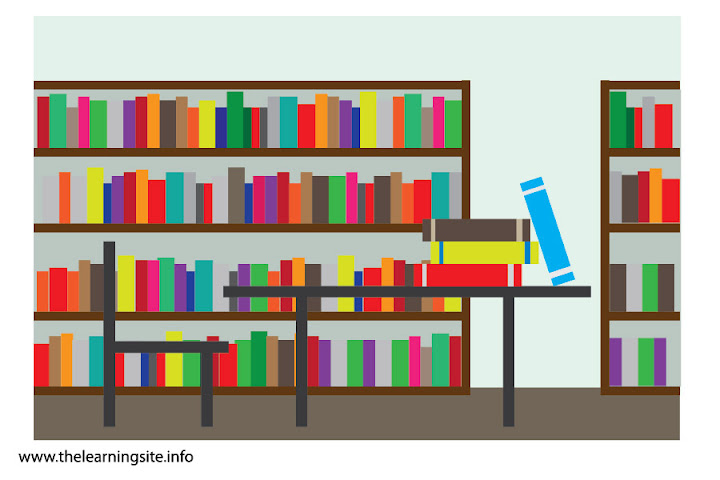
Locate an element on the screen. This screenshot has height=480, width=720. shelf is located at coordinates (240, 388), (248, 314), (186, 226), (194, 149), (210, 84), (649, 82), (648, 151), (639, 229), (639, 315), (634, 391).